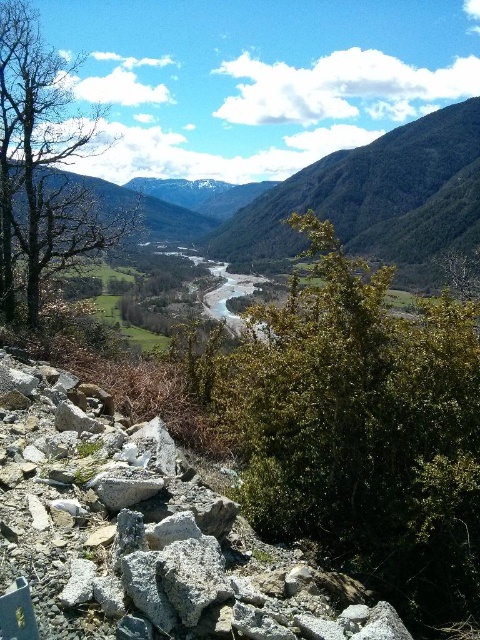
Is green leafy bush at center thinner than bare wood tree at left?

No, green leafy bush at center is not thinner than bare wood tree at left.

Looking at this image, does green leafy bush at center come in front of bare wood tree at left?

Yes, it is in front of bare wood tree at left.

Who is more distant from viewer, (470, 588) or (2, 266)?

Point (2, 266)

Where is `green leafy bush at center`? The height and width of the screenshot is (640, 480). green leafy bush at center is located at coordinates (362, 429).

Is point (315, 500) positioned after point (230, 557)?

Yes, point (315, 500) is farther from viewer.

Is green leafy bush at center closer to camera compared to gray rough rock at lower left?

No, green leafy bush at center is further to the viewer.

Between point (300, 316) and point (41, 596), which one is positioned in front?

Point (41, 596) is more forward.

Locate an element on the screen. This screenshot has height=640, width=480. green leafy bush at center is located at coordinates (362, 429).

Between green leafy bush at center and green textured mountain at center, which one has less height?

green leafy bush at center is shorter.

Between point (406, 477) and point (282, 225), which one is positioned in front?

Positioned in front is point (406, 477).

Image resolution: width=480 pixels, height=640 pixels. I want to click on green leafy bush at center, so click(x=362, y=429).